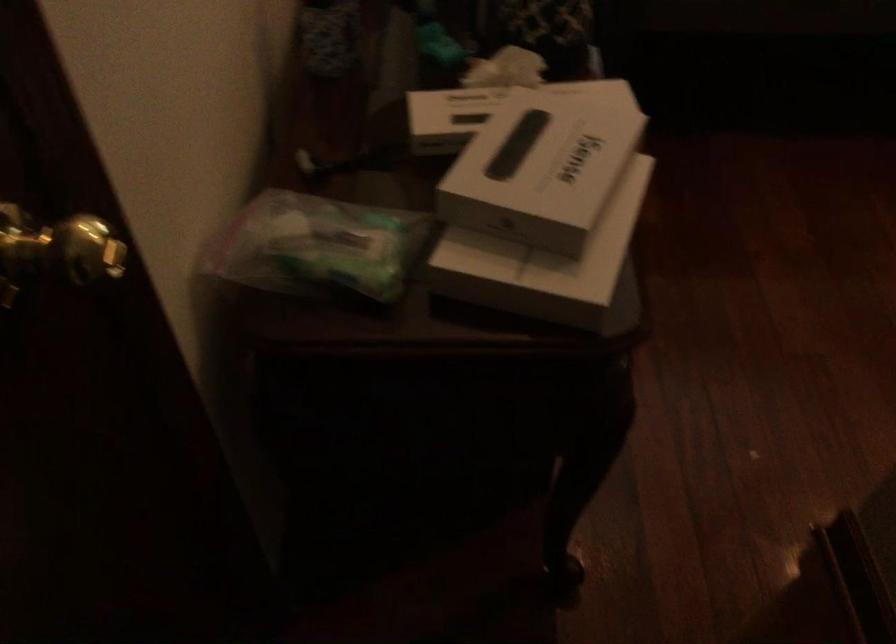
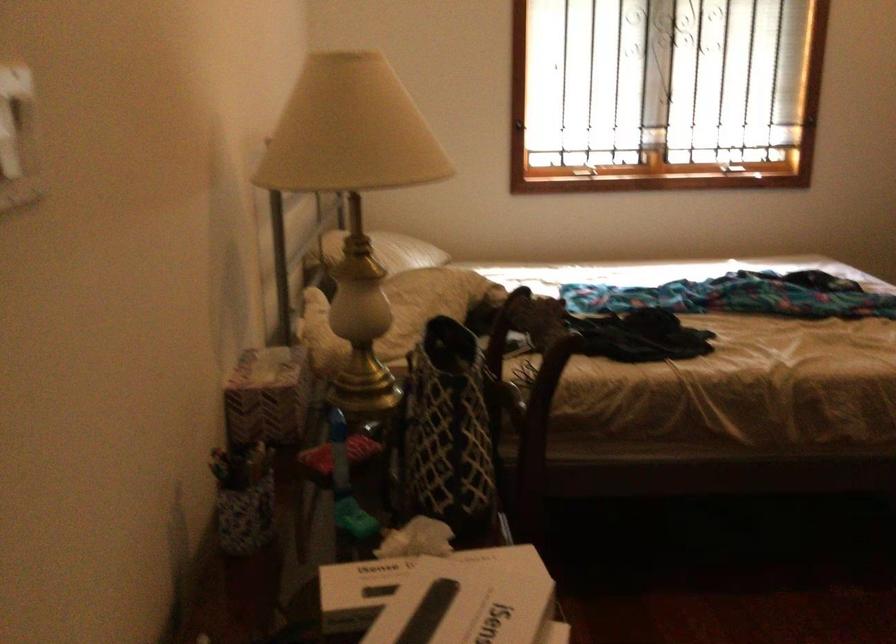
The point at (501, 106) is marked in the first image. Where is the corresponding point in the second image?

(407, 583)